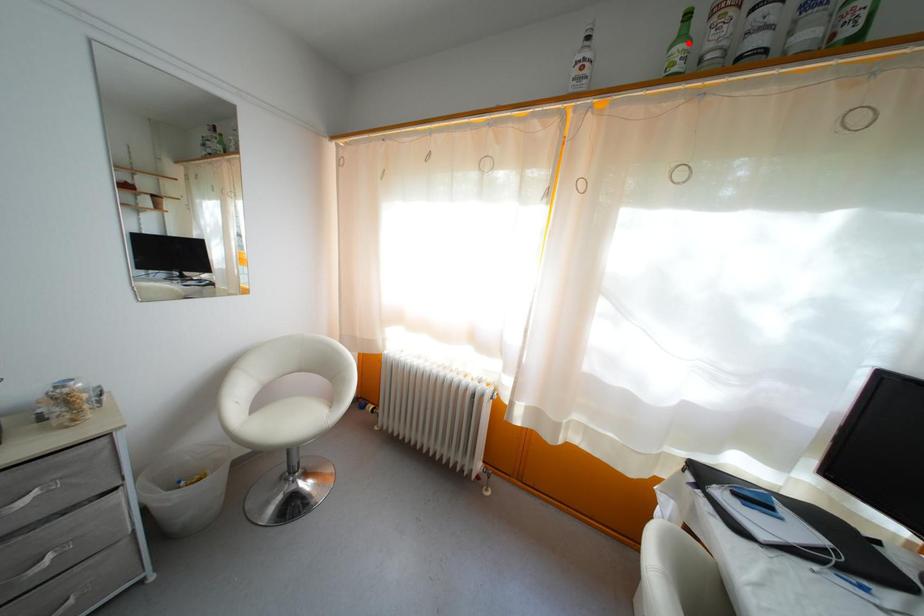
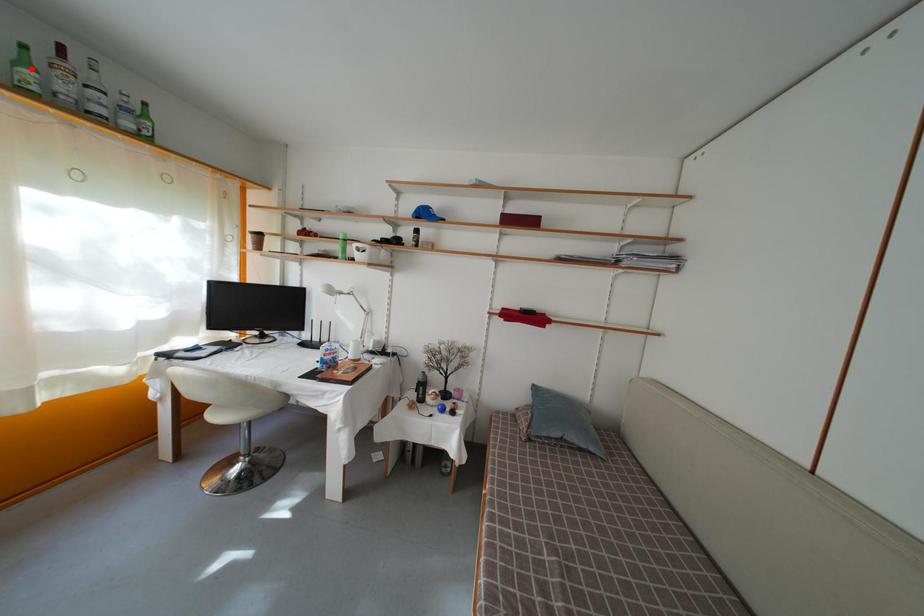
I am providing you with two images of the same scene from different viewpoints. A red point is marked on the first image and another point is marked on the second image. Do the highlighted points in image1 and image2 indicate the same real-world spot?

Yes